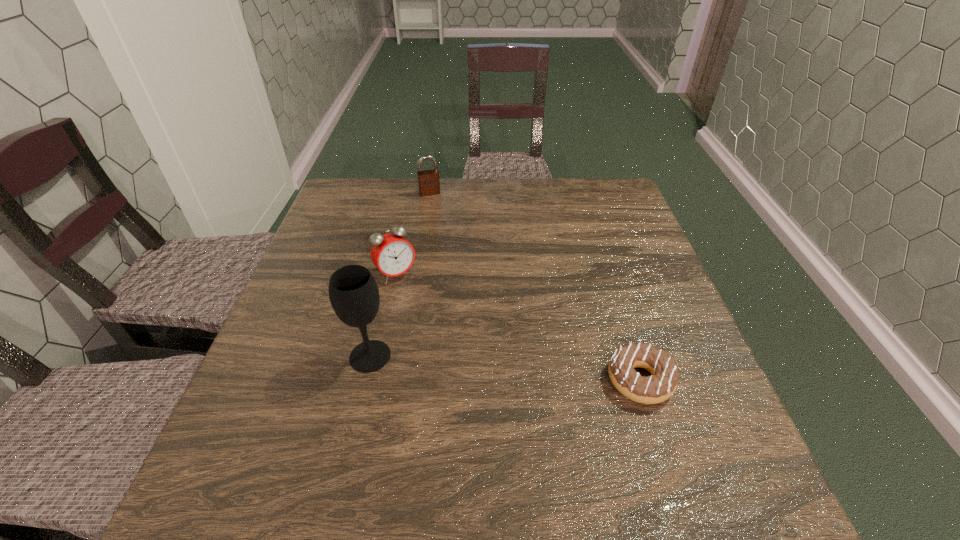
I want to click on free space between the wineglass and the rightmost object, so click(x=505, y=368).

Locate an element on the screen. The height and width of the screenshot is (540, 960). free area in between the alarm clock and the padlock is located at coordinates (413, 234).

This screenshot has width=960, height=540. I want to click on object that stands as the closest to the farthest object, so click(391, 253).

Identify which object is the second nearest to the farthest object. Please provide its 2D coordinates. Your answer should be formatted as a tuple, i.e. [(x, y)], where the tuple contains the x and y coordinates of a point satisfying the conditions above.

[(353, 292)]

Locate an element on the screen. vacant area that satisfies the following two spatial constraints: 1. on the back side of the wineglass; 2. on the right side of the alarm clock is located at coordinates (389, 274).

Identify the location of free space in the image that satisfies the following two spatial constraints: 1. on the back side of the padlock; 2. on the right side of the wineglass. (408, 193).